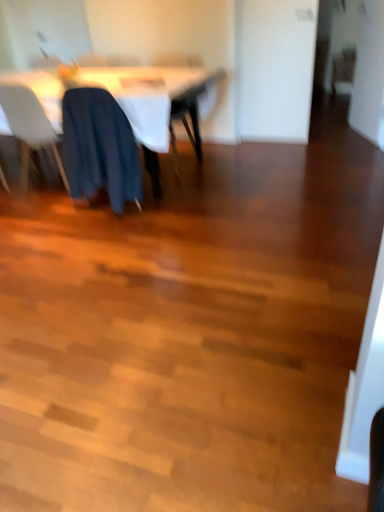
I want to click on blank space to the left of dark blue fabric at center, acting as the second chair starting from the left, so click(48, 215).